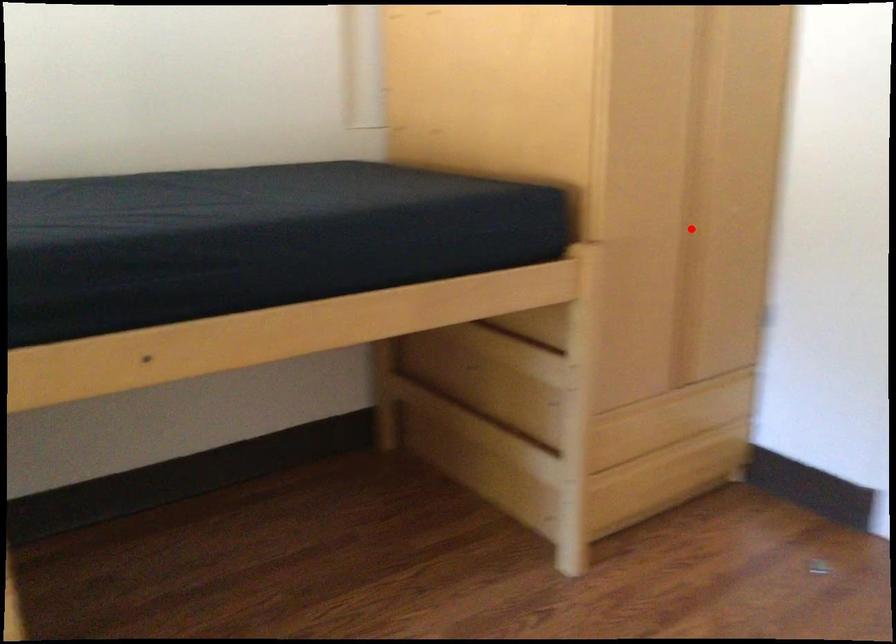
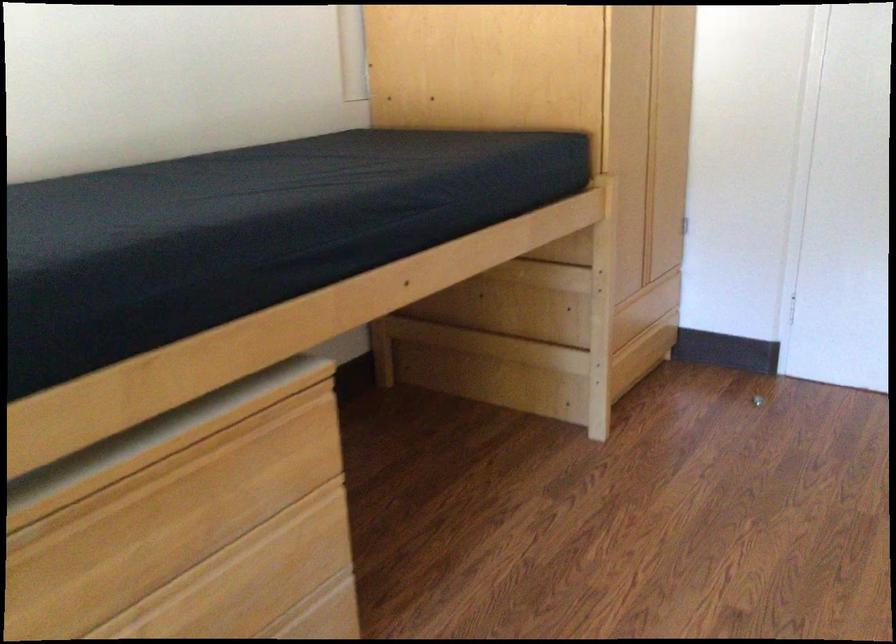
Question: I am providing you with two images of the same scene from different viewpoints. Image1 has a red point marked. In image2, the corresponding 3D location appears at what relative position? Reply with the corresponding letter.

Choices:
 (A) Closer
 (B) Farther

Answer: (B)